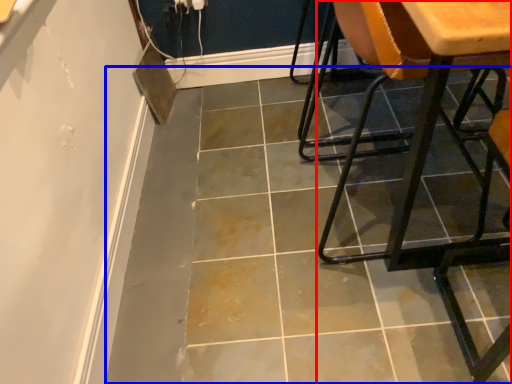
Question: Which of the following is the closest to the observer, chair (highlighted by a red box) or concrete (highlighted by a blue box)?

Choices:
 (A) chair
 (B) concrete

Answer: (A)